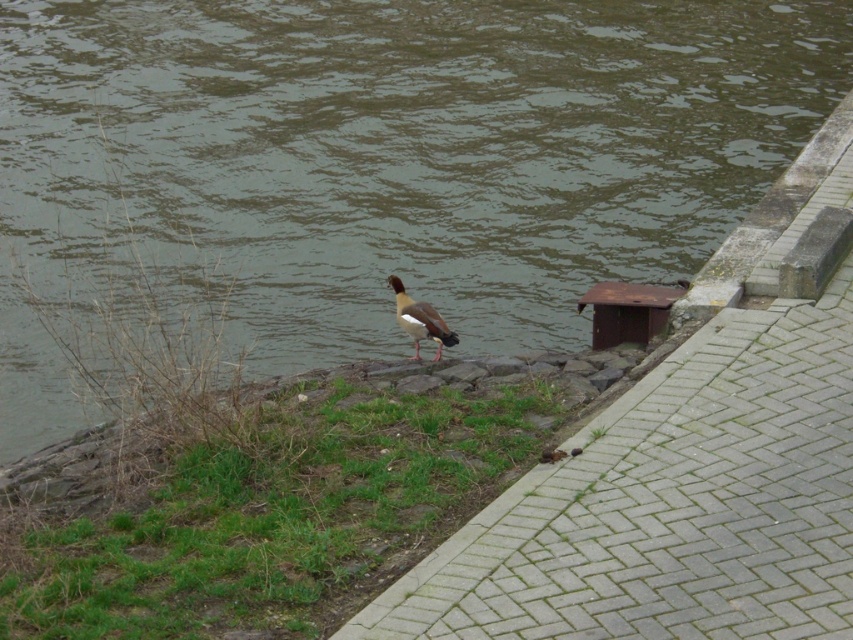
Question: Is brown water at center smaller than brown feathered duck at center?

Choices:
 (A) yes
 (B) no

Answer: (B)

Question: Which point is farther to the camera?

Choices:
 (A) green grass at center
 (B) brown feathered duck at center
 (C) brown water at center

Answer: (B)

Question: In this image, where is green grass at center located relative to brown feathered duck at center?

Choices:
 (A) left
 (B) right

Answer: (A)

Question: Estimate the real-world distances between objects in this image. Which object is farther from the brown feathered duck at center?

Choices:
 (A) green grass at center
 (B) brown water at center

Answer: (B)

Question: Does brown water at center have a smaller size compared to brown feathered duck at center?

Choices:
 (A) no
 (B) yes

Answer: (A)

Question: Which of the following is the closest to the observer?

Choices:
 (A) (328, 294)
 (B) (199, 529)
 (C) (410, 300)

Answer: (B)